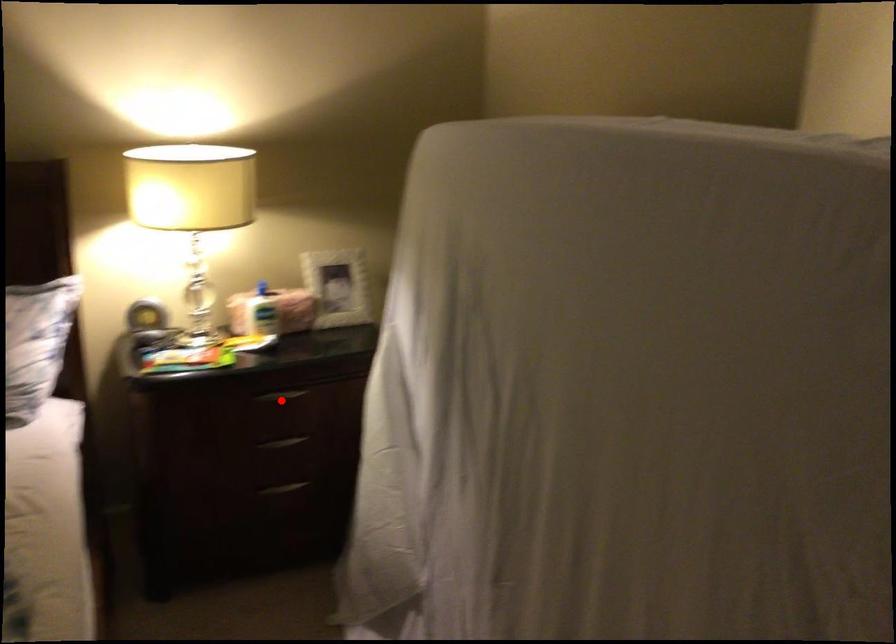
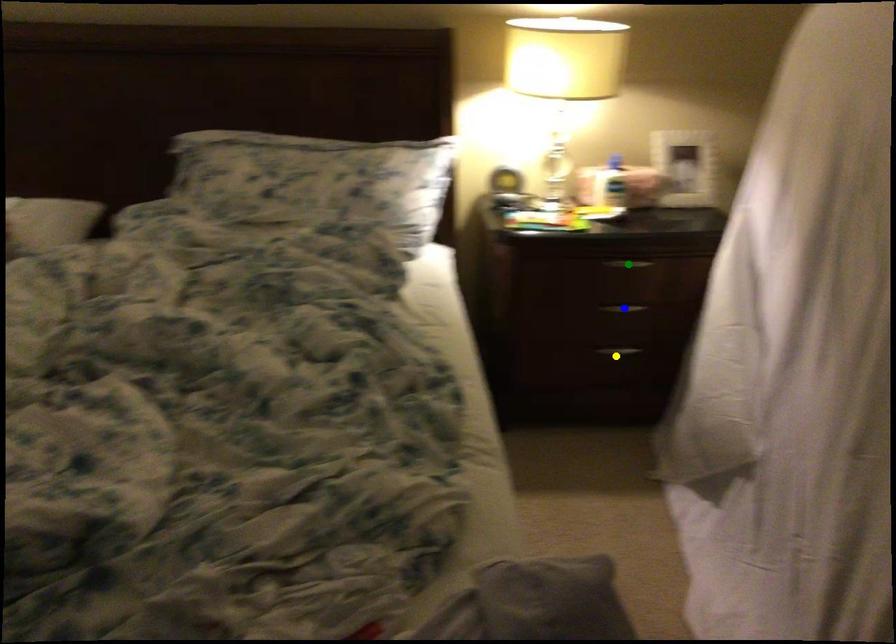
Question: I am providing you with two images of the same scene from different viewpoints. A red point is marked on the first image. You are given multiple points on the second image. Which point in image 2 is actually the same real-world point as the red point in image 1?

Choices:
 (A) green point
 (B) blue point
 (C) yellow point

Answer: (A)